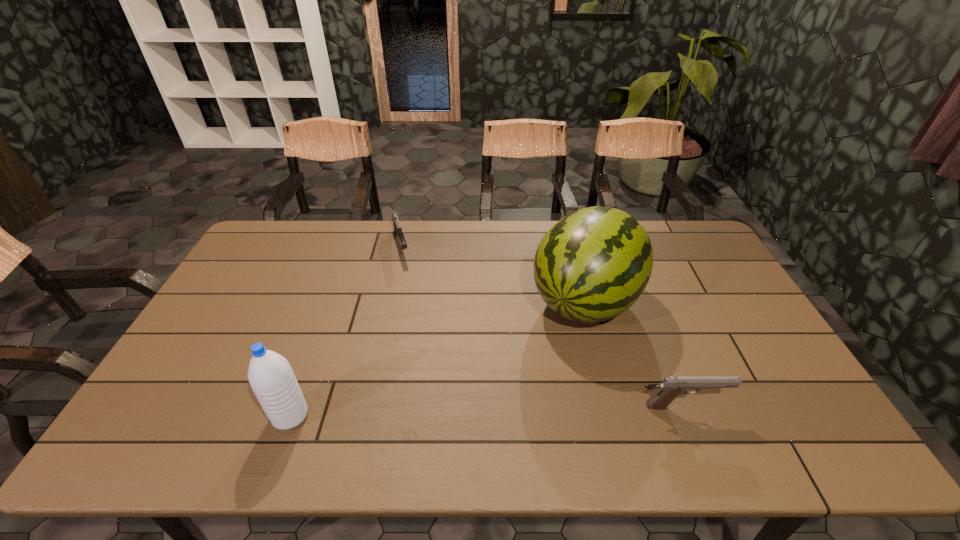
You are a GUI agent. You are given a task and a screenshot of the screen. Output one action in this format:
    pyautogui.click(x=<x>, y=<y>)
    Task: Click on the second tallest object
    Image resolution: width=960 pixels, height=540 pixels.
    Given the screenshot: What is the action you would take?
    pyautogui.click(x=270, y=375)

The width and height of the screenshot is (960, 540). Identify the location of the leftmost object. (270, 375).

Identify the location of the second shortest object. (672, 386).

At what (x,y) coordinates should I click in order to perform the action: click on the second object from left to right. Please return your answer as a coordinate pair (x, y). The width and height of the screenshot is (960, 540). Looking at the image, I should click on (397, 228).

At what (x,y) coordinates should I click in order to perform the action: click on the shortest object. Please return your answer as a coordinate pair (x, y). The height and width of the screenshot is (540, 960). Looking at the image, I should click on pos(397,228).

In order to click on the tallest object in this screenshot , I will do `click(593, 264)`.

Where is `watermelon`? The image size is (960, 540). watermelon is located at coordinates (593, 264).

This screenshot has width=960, height=540. I want to click on vacant space situated 0.310m on the back of the second tallest object, so click(x=328, y=312).

Image resolution: width=960 pixels, height=540 pixels. I want to click on vacant space located 0.070m at the barrel of the third tallest object, so click(x=752, y=407).

Where is `free point located at the muzzle end of the second object from left to right`? This screenshot has height=540, width=960. free point located at the muzzle end of the second object from left to right is located at coordinates (419, 324).